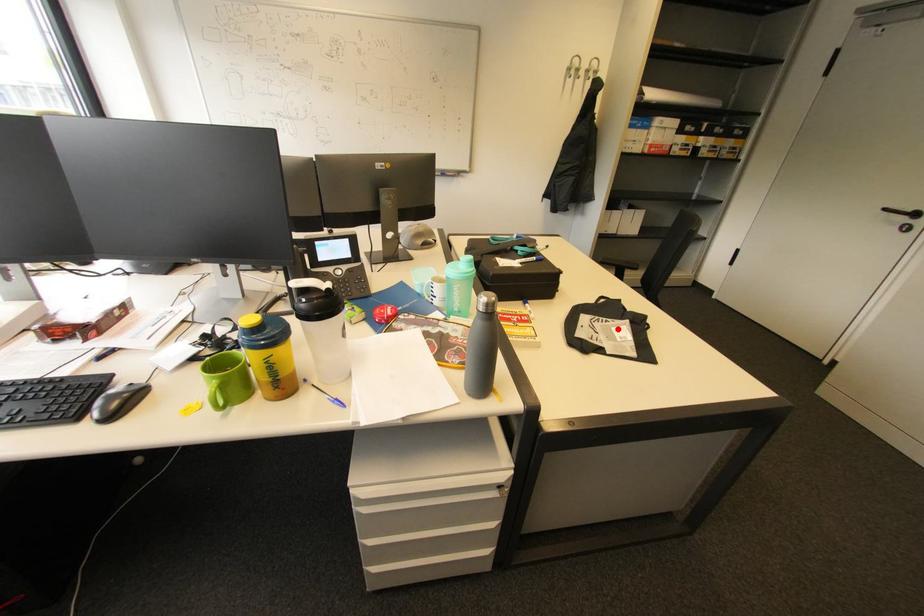
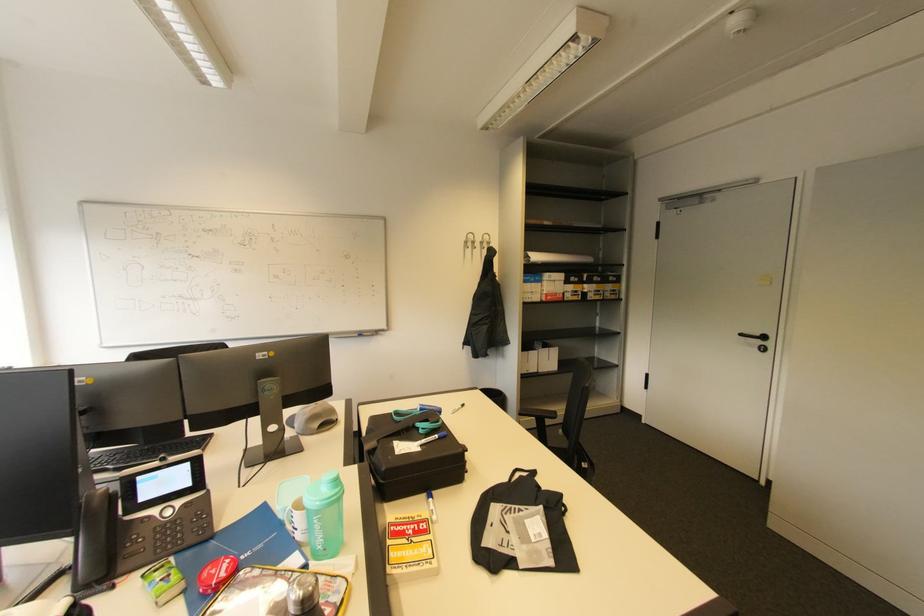
Find the pixel in the second image that matches the highlighted location in the first image.

(531, 523)